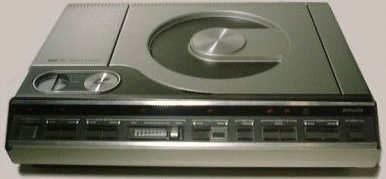
Identify the location of front panel of black switches. Image resolution: width=386 pixels, height=179 pixels. (189, 132).